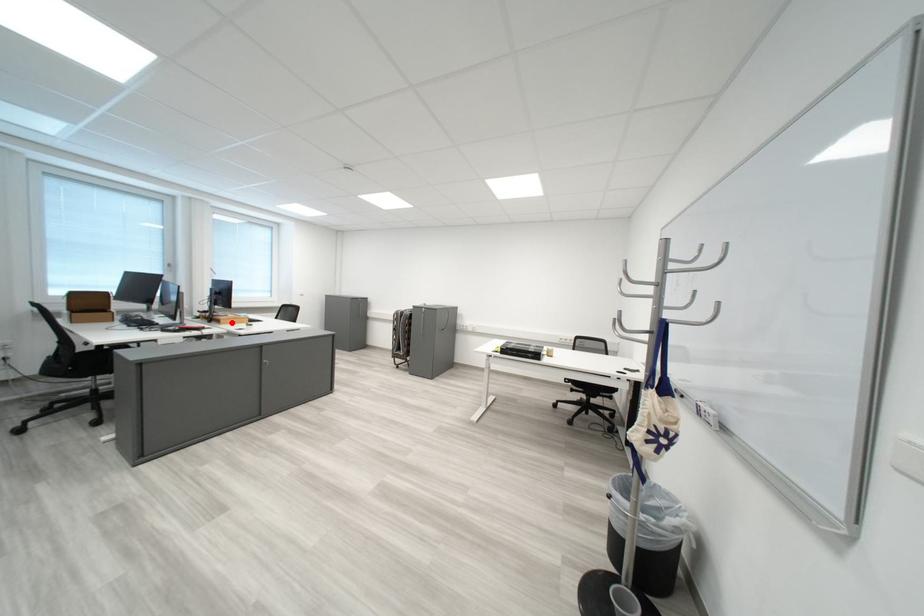
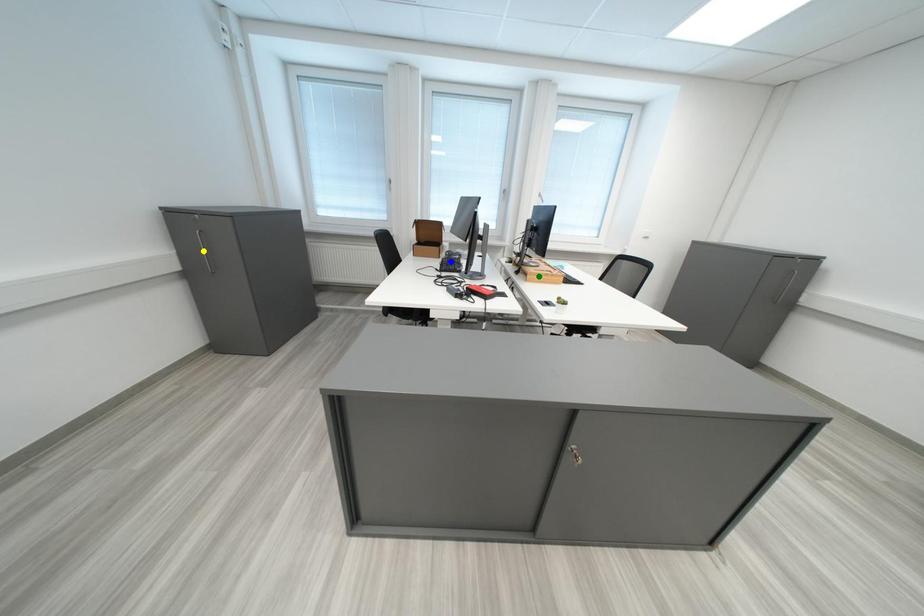
Question: I am providing you with two images of the same scene from different viewpoints. A red point is marked on the first image. You are given multiple points on the second image. Which mark in image 2 goes with the point in image 1?

Choices:
 (A) yellow point
 (B) green point
 (C) blue point

Answer: (B)